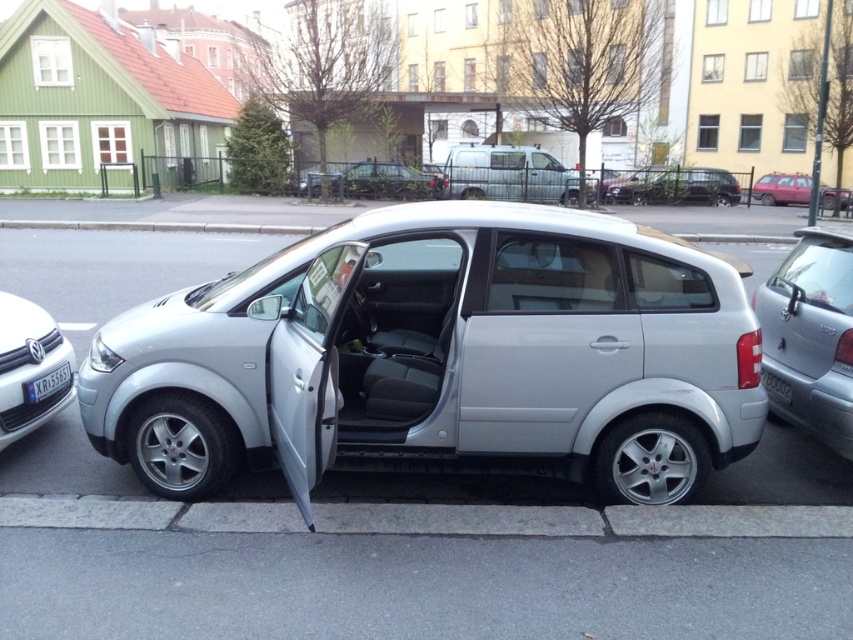
Can you confirm if metallic silver hatchback at center is wider than black plastic license plate at lower right?

Correct, the width of metallic silver hatchback at center exceeds that of black plastic license plate at lower right.

Is metallic silver hatchback at center smaller than black plastic license plate at lower right?

No, metallic silver hatchback at center is not smaller than black plastic license plate at lower right.

Where is `metallic silver hatchback at center`? This screenshot has width=853, height=640. metallic silver hatchback at center is located at coordinates (374, 180).

Which is below, gray concrete curb at lower center or black plastic license plate at lower right?

Positioned lower is gray concrete curb at lower center.

Does point (386, 516) lie in front of point (776, 378)?

Yes, point (386, 516) is in front of point (776, 378).

Where is `gray concrete curb at lower center`? The height and width of the screenshot is (640, 853). gray concrete curb at lower center is located at coordinates (585, 518).

Does satin silver door at center have a smaller size compared to black plastic license plate at lower left?

No.

Who is more forward, (558, 356) or (44, 381)?

Point (558, 356) is in front.

Locate an element on the screen. Image resolution: width=853 pixels, height=640 pixels. satin silver door at center is located at coordinates (541, 340).